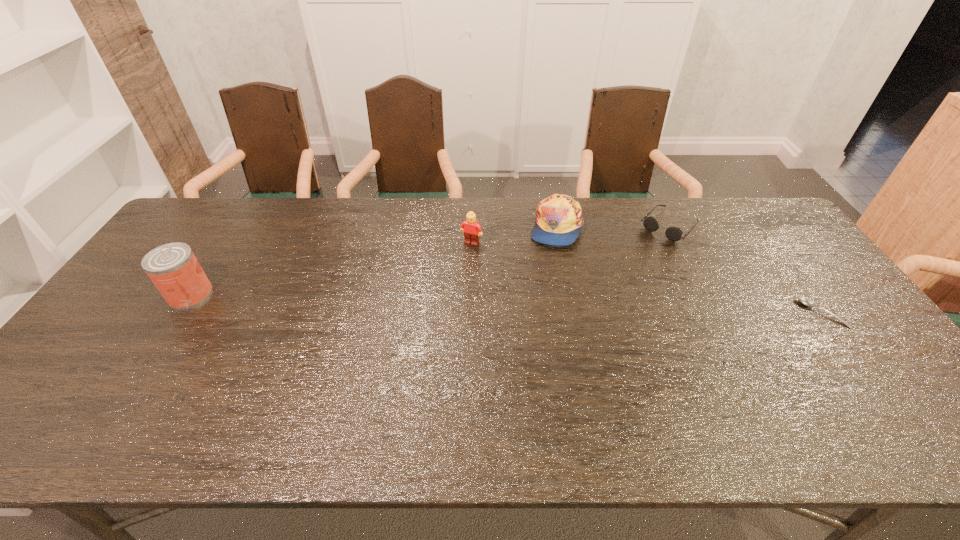
Where is `free space on the desktop that is between the leftmost object and the rightmost object and is positioned on the bill of the third object from right to left`? free space on the desktop that is between the leftmost object and the rightmost object and is positioned on the bill of the third object from right to left is located at coordinates (594, 306).

Image resolution: width=960 pixels, height=540 pixels. Identify the location of free space on the desktop that is between the leftmost object and the shortest object and is positioned on the front-facing side of the sunglasses. (591, 306).

Locate an element on the screen. The width and height of the screenshot is (960, 540). free space on the desktop that is between the can and the soupspoon and is positioned on the face of the Lego is located at coordinates (437, 302).